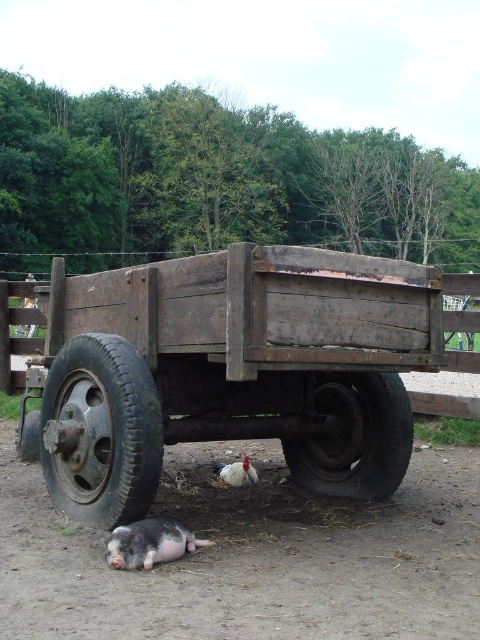
Where is `rustic wood cart at center`? The image size is (480, 640). rustic wood cart at center is located at coordinates (230, 371).

Between rustic wood cart at center and brown dirt track at lower center, which one appears on the left side from the viewer's perspective?

Positioned to the left is rustic wood cart at center.

The width and height of the screenshot is (480, 640). Describe the element at coordinates (230, 371) in the screenshot. I see `rustic wood cart at center` at that location.

In order to click on rustic wood cart at center in this screenshot , I will do `click(230, 371)`.

Can you confirm if black rubber tire at lower left is shorter than black rubber tire at lower center?

In fact, black rubber tire at lower left may be taller than black rubber tire at lower center.

Is point (151, 452) positioned after point (354, 394)?

No.

This screenshot has height=640, width=480. Find the location of `black rubber tire at lower left`. black rubber tire at lower left is located at coordinates (100, 432).

Which is above, black rubber tire at lower left or piggy pink fur at lower center?

black rubber tire at lower left is above.

Is black rubber tire at lower left wider than piggy pink fur at lower center?

Correct, the width of black rubber tire at lower left exceeds that of piggy pink fur at lower center.

Is point (52, 488) farther from viewer compared to point (205, 544)?

Yes, it is.

I want to click on black rubber tire at lower left, so click(x=100, y=432).